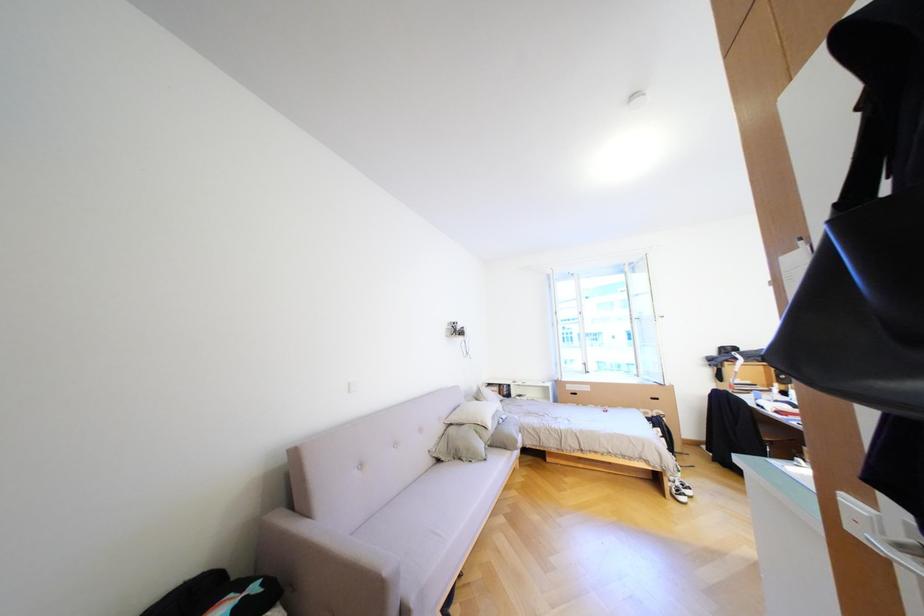
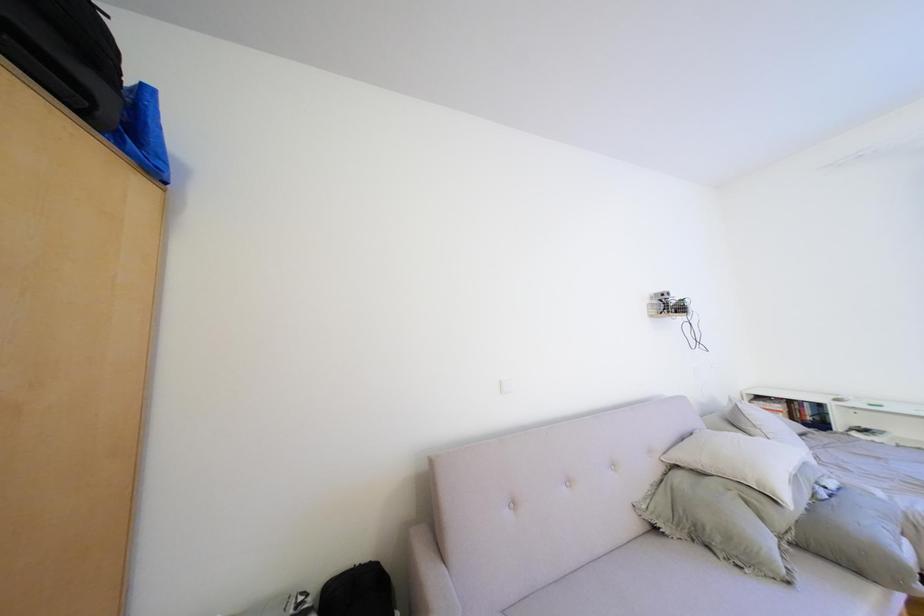
Question: Based on the continuous images, in which direction is the camera rotating? Reply with the corresponding letter.

Choices:
 (A) Left
 (B) Right
 (C) Up
 (D) Down

Answer: (A)